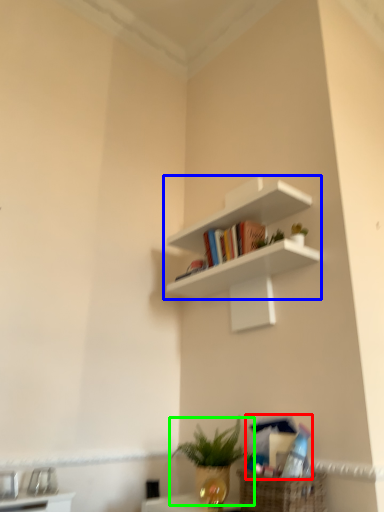
Question: Which object is the farthest from book (highlighted by a red box)? Choose among these: shelf (highlighted by a blue box) or houseplant (highlighted by a green box).

Choices:
 (A) shelf
 (B) houseplant

Answer: (A)